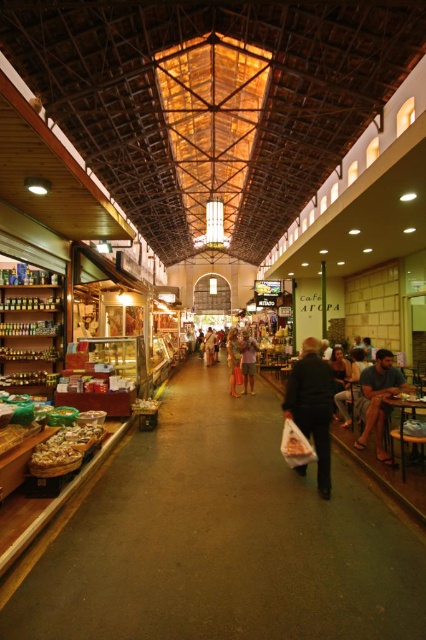
You are a customer in the market and want to pick up both the dark blue fabric shirt at right and the orange fabric dress at center. Can you walk directly between them without needing to go around any obstacles?

The dark blue fabric shirt at right and orange fabric dress at center are 7.40 meters apart, so yes, you can walk directly between them without needing to go around any obstacles since the distance is sufficient for a clear path.